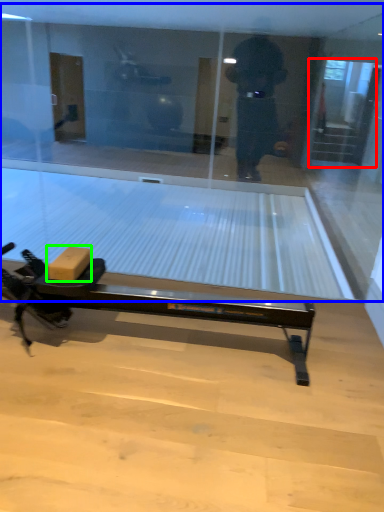
Question: Based on their relative distances, which object is farther from screen door (highlighted by a red box)? Choose from shop window (highlighted by a blue box) and cardboard box (highlighted by a green box).

Choices:
 (A) shop window
 (B) cardboard box

Answer: (B)